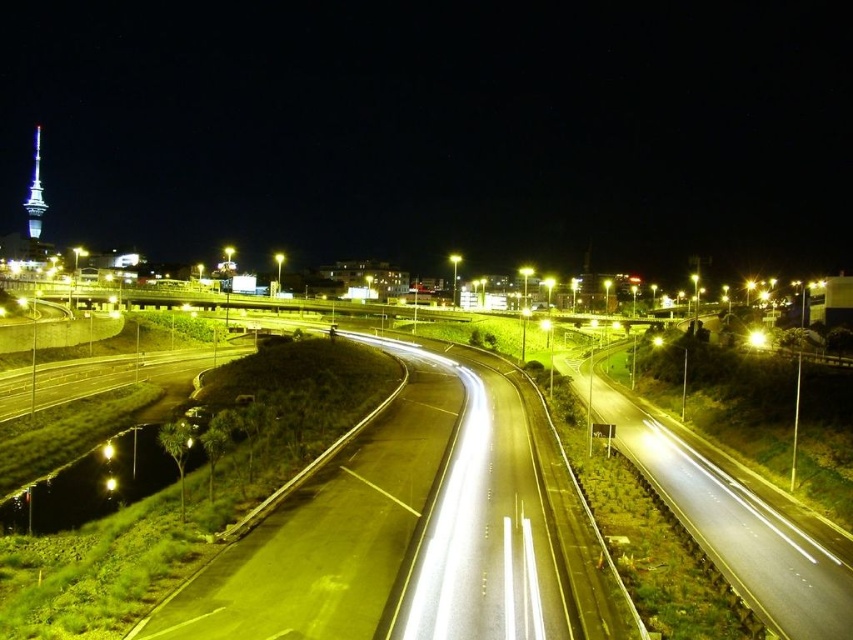
You are standing at the point marked by coordinates point [728,518]. What is the object you are standing on?

The point [728,518] marks the black asphalt highway at center.

A pedestrian wants to cross the highway from the point at (781,566) to the point at 0.113, 0.083. Given that the safe crossing distance is 40 meters, will they be able to cross safely?

The distance between the point at (781,566) and the point at 0.113, 0.083 is 41.01 meters, which exceeds the safe crossing distance of 40 meters. Therefore, the pedestrian will not be able to cross safely.